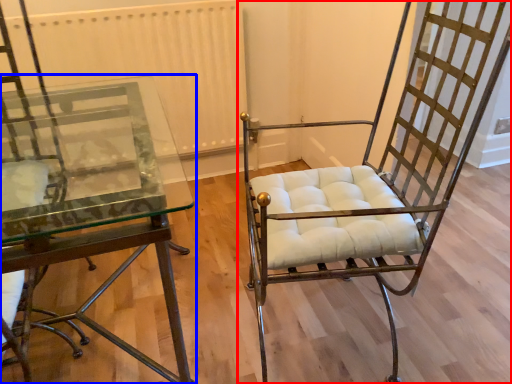
Question: Which object appears closest to the camera in this image, chair (highlighted by a red box) or table (highlighted by a blue box)?

Choices:
 (A) chair
 (B) table

Answer: (B)